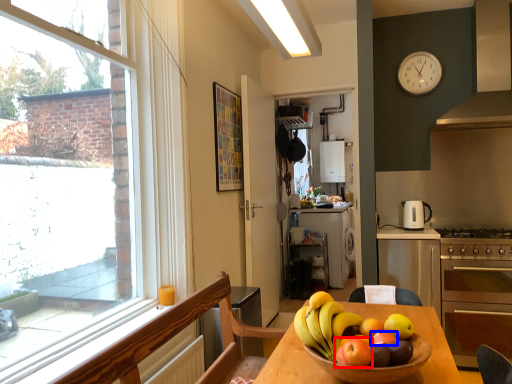
Question: Which object appears farthest to the camera in this image, apple (highlighted by a red box) or apple (highlighted by a blue box)?

Choices:
 (A) apple
 (B) apple

Answer: (B)